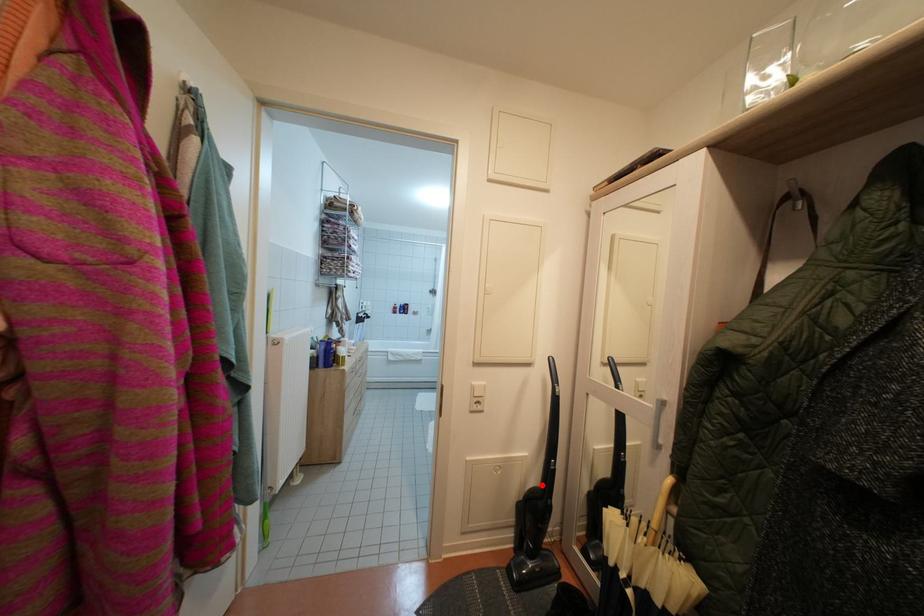
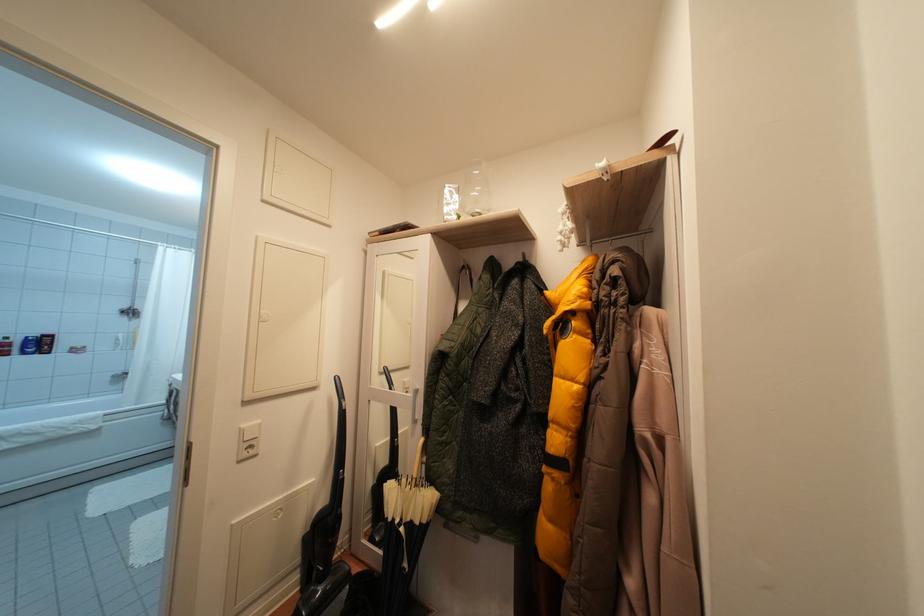
Where in the second image is the point corresponding to the highlighted location from the first image?

(331, 506)